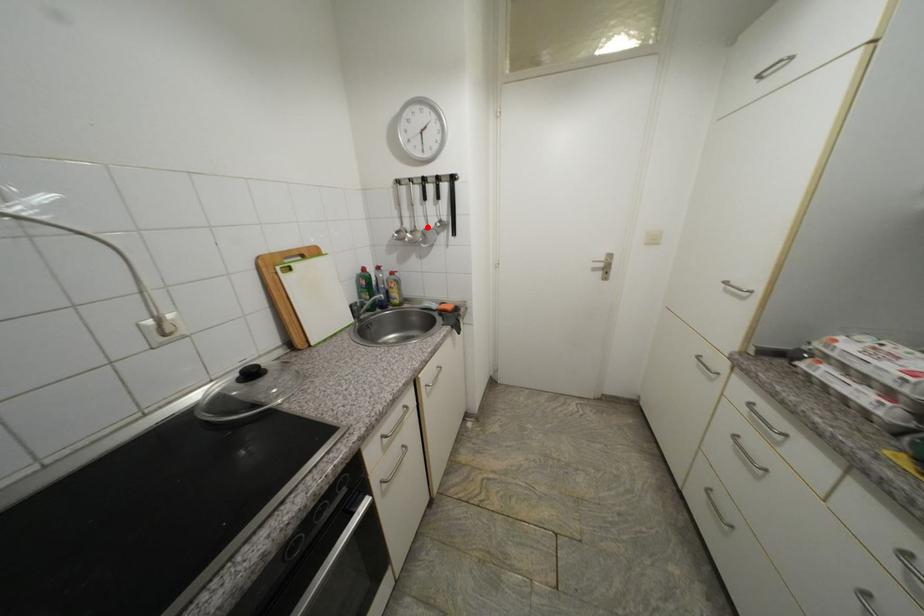
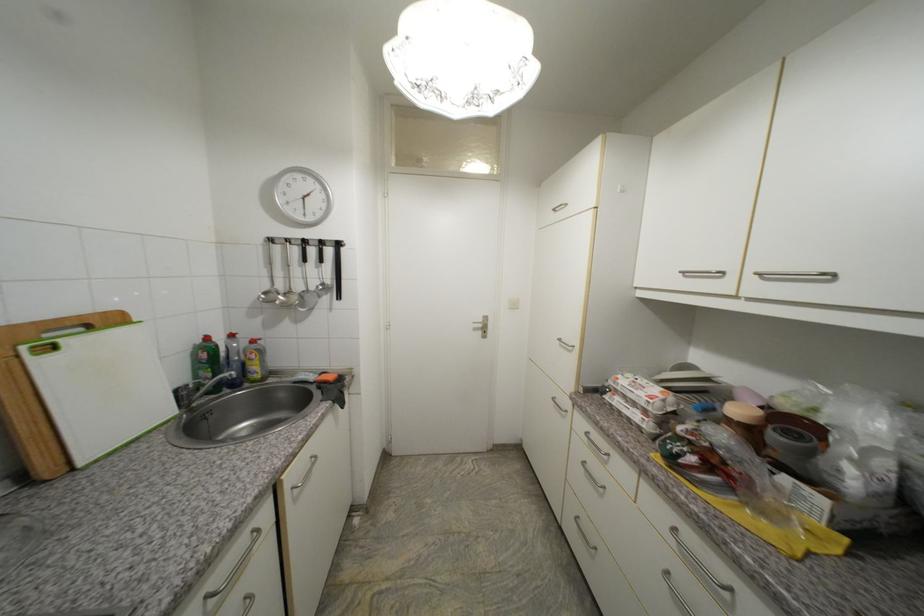
The point at the highlighted location is marked in the first image. Where is the corresponding point in the second image?

(305, 289)